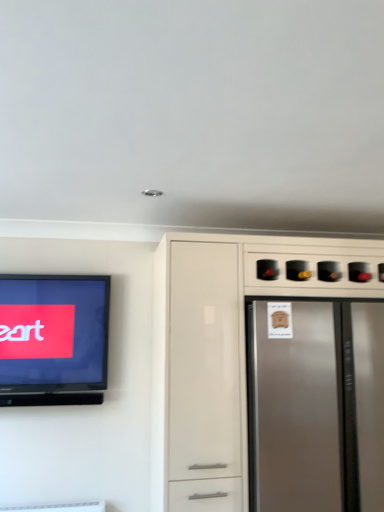
Question: From the image's perspective, is satin silver refrigerator at right located beneath satin white cabinet at right?

Choices:
 (A) yes
 (B) no

Answer: (A)

Question: Would you say satin silver refrigerator at right is outside satin white cabinet at right?

Choices:
 (A) yes
 (B) no

Answer: (B)

Question: Considering the relative sizes of satin silver refrigerator at right and satin white cabinet at right in the image provided, is satin silver refrigerator at right thinner than satin white cabinet at right?

Choices:
 (A) no
 (B) yes

Answer: (A)

Question: Does satin silver refrigerator at right turn towards satin white cabinet at right?

Choices:
 (A) yes
 (B) no

Answer: (A)

Question: Is satin silver refrigerator at right positioned with its back to satin white cabinet at right?

Choices:
 (A) no
 (B) yes

Answer: (B)

Question: Considering the relative sizes of satin silver refrigerator at right and satin white cabinet at right in the image provided, is satin silver refrigerator at right smaller than satin white cabinet at right?

Choices:
 (A) yes
 (B) no

Answer: (A)

Question: Considering the relative positions of satin white cabinet at right and matte black television at left in the image provided, is satin white cabinet at right to the right of matte black television at left from the viewer's perspective?

Choices:
 (A) no
 (B) yes

Answer: (B)

Question: Does satin white cabinet at right have a smaller size compared to matte black television at left?

Choices:
 (A) yes
 (B) no

Answer: (B)

Question: Is satin white cabinet at right aimed at matte black television at left?

Choices:
 (A) yes
 (B) no

Answer: (B)

Question: Is satin white cabinet at right next to matte black television at left and touching it?

Choices:
 (A) no
 (B) yes

Answer: (A)

Question: Is satin white cabinet at right outside matte black television at left?

Choices:
 (A) no
 (B) yes

Answer: (B)

Question: Does satin white cabinet at right appear on the left side of matte black television at left?

Choices:
 (A) no
 (B) yes

Answer: (A)

Question: Considering the relative sizes of satin silver refrigerator at right and matte black television at left in the image provided, is satin silver refrigerator at right thinner than matte black television at left?

Choices:
 (A) no
 (B) yes

Answer: (A)